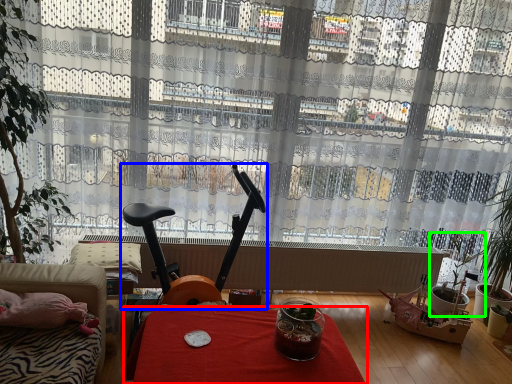
Question: Which object is the closest to the table (highlighted by a red box)? Choose among these: swivel chair (highlighted by a blue box) or houseplant (highlighted by a green box).

Choices:
 (A) swivel chair
 (B) houseplant

Answer: (A)